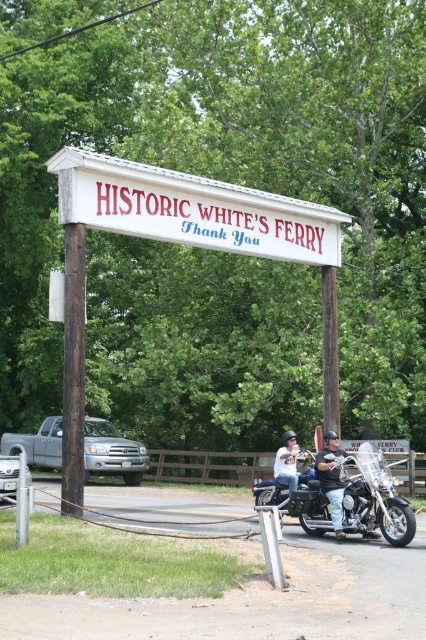
From the picture: You are standing at the Historic White s Ferry sign and want to take a photo of two points marked in the scene. One point is at coordinate point [101,173] and the other is at point [405,529]. Which point will appear closer to you in the photo?

Point [101,173] is further to the camera than point [405,529], so the point at [101,173] will appear closer to you in the photo.

You are a photographer planning to take a wide shot of the Historic White s Ferry scene. You want to ensure both the shiny chrome motorcycle at center and the rusty wood signpost at left are clearly visible in the frame. Given their sizes, which object might require you to adjust your camera angle to prevent it from being too dominant in the photo?

The shiny chrome motorcycle at center has a larger size compared to the rusty wood signpost at left, so it might require adjusting the camera angle to avoid it being too dominant in the photo.